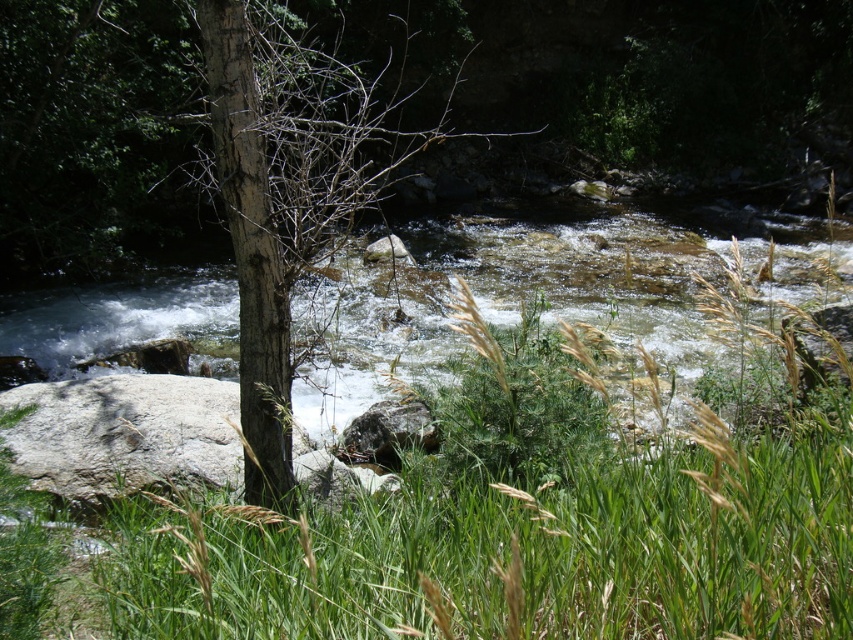
Which of these two, clear water at center or brown rough tree trunk at center-left, stands shorter?

clear water at center is shorter.

Where is `clear water at center`? This screenshot has width=853, height=640. clear water at center is located at coordinates (509, 301).

Can you confirm if brown rough tree trunk at center-left is smaller than gray rough rock at center?

No, brown rough tree trunk at center-left is not smaller than gray rough rock at center.

Consider the image. Who is shorter, brown rough tree trunk at center-left or gray rough rock at center?

With less height is gray rough rock at center.

Is point (302, 108) less distant than point (341, 452)?

No, it is not.

Identify the location of brown rough tree trunk at center-left. Image resolution: width=853 pixels, height=640 pixels. (286, 193).

Is clear water at center smaller than gray smooth rock at center?

No, clear water at center is not smaller than gray smooth rock at center.

Is clear water at center in front of gray smooth rock at center?

Yes, clear water at center is in front of gray smooth rock at center.

Does point (106, 371) come in front of point (379, 244)?

Yes, point (106, 371) is in front of point (379, 244).

Locate an element on the screen. clear water at center is located at coordinates (509, 301).